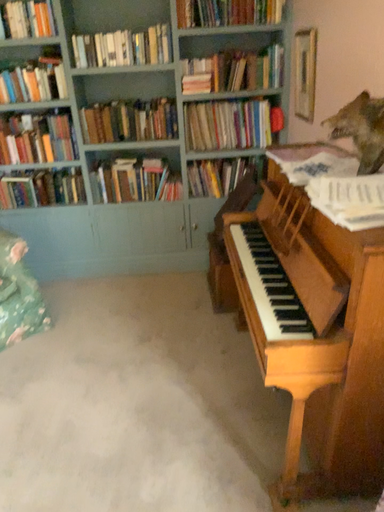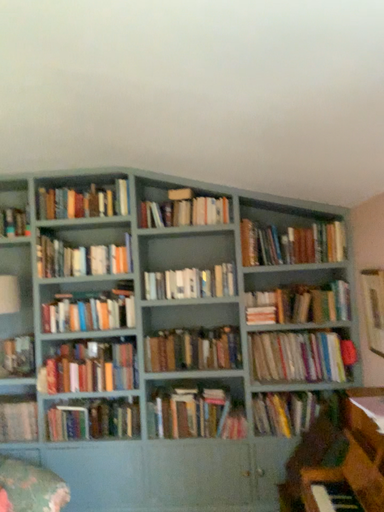
Question: How did the camera likely rotate when shooting the video?

Choices:
 (A) rotated right
 (B) rotated left

Answer: (B)